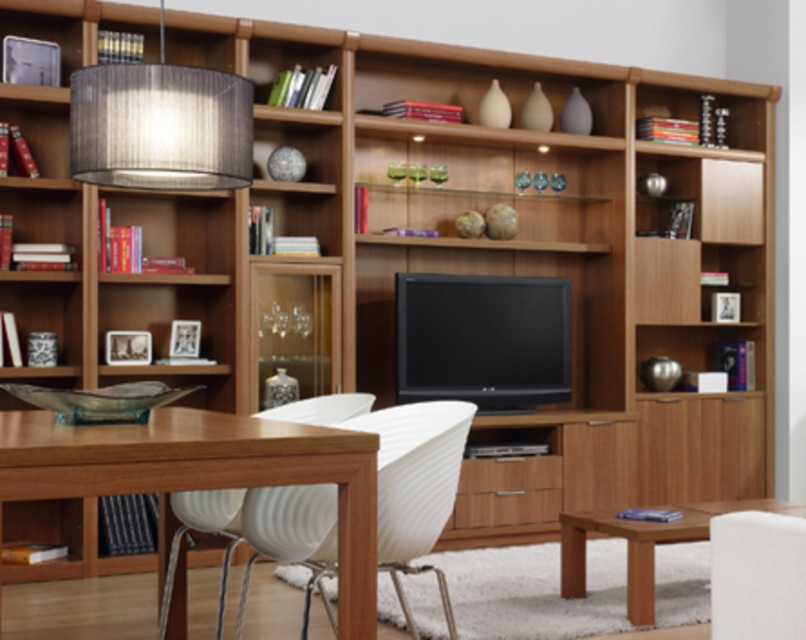
Is matte gray fabric lampshade at upper left below white fabric armchair at lower right?

No, matte gray fabric lampshade at upper left is not below white fabric armchair at lower right.

Is matte gray fabric lampshade at upper left positioned in front of white fabric armchair at lower right?

No, matte gray fabric lampshade at upper left is behind white fabric armchair at lower right.

Between point (82, 166) and point (794, 566), which one is positioned behind?

Positioned behind is point (82, 166).

The height and width of the screenshot is (640, 806). In order to click on matte gray fabric lampshade at upper left in this screenshot , I will do `click(160, 125)`.

Is wooden table at lower left positioned behind white ribbed plastic chair at center?

No, it is not.

Where is `wooden table at lower left`? Image resolution: width=806 pixels, height=640 pixels. wooden table at lower left is located at coordinates click(202, 474).

Locate an element on the screen. wooden table at lower left is located at coordinates (202, 474).

Is white ribbed plastic chair at center wider than white fabric armchair at lower right?

Yes, white ribbed plastic chair at center is wider than white fabric armchair at lower right.

Which is more to the right, white ribbed plastic chair at center or white fabric armchair at lower right?

Positioned to the right is white fabric armchair at lower right.

Is point (385, 556) more distant than point (796, 522)?

Yes, it is behind point (796, 522).

Locate an element on the screen. This screenshot has height=640, width=806. white ribbed plastic chair at center is located at coordinates (414, 474).